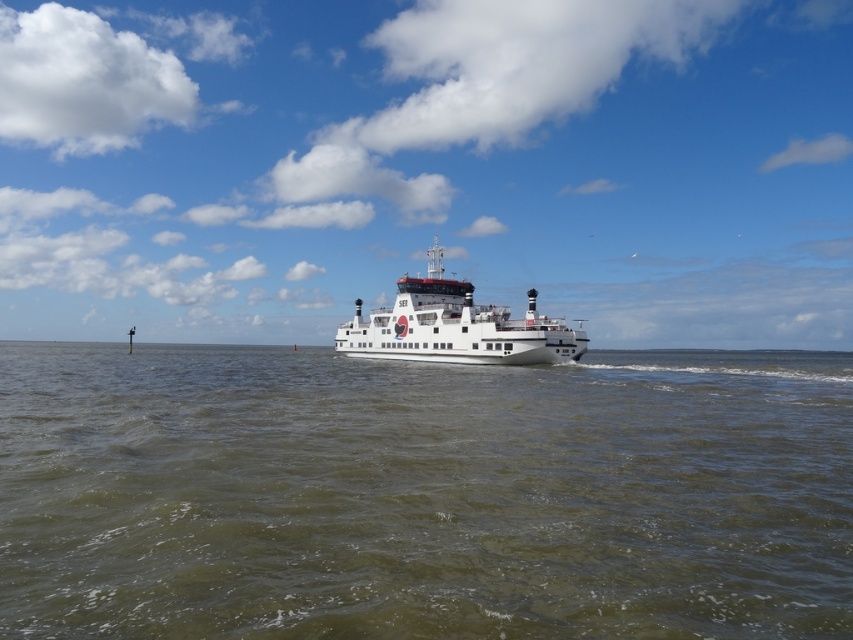
Is point (668, 538) farther from camera compared to point (566, 328)?

No, it is in front of (566, 328).

Who is more forward, (628,612) or (379,326)?

Positioned in front is point (628,612).

The height and width of the screenshot is (640, 853). Find the location of `greenish water at center`. greenish water at center is located at coordinates (422, 493).